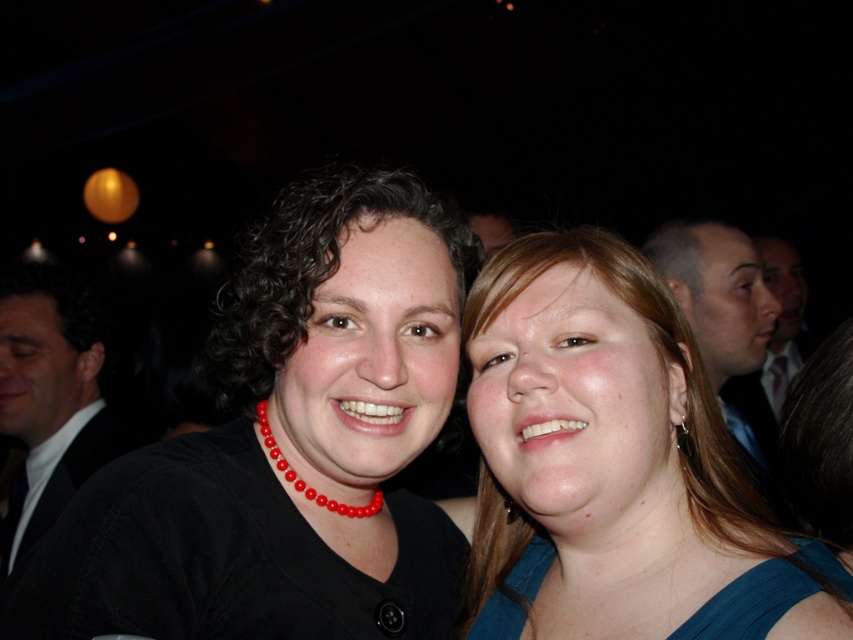
Is black suit at left to the right of shiny black suit at right from the viewer's perspective?

No, black suit at left is not to the right of shiny black suit at right.

Does black suit at left appear under shiny black suit at right?

Yes, black suit at left is below shiny black suit at right.

Between point (32, 502) and point (712, 378), which one is positioned in front?

Point (712, 378) is in front.

The image size is (853, 640). Identify the location of black suit at left. (53, 392).

Who is positioned more to the left, shiny black suit at right or red beaded necklace at center?

red beaded necklace at center is more to the left.

Between point (752, 253) and point (293, 470), which one is positioned behind?

The point (752, 253) is behind.

Identify the location of shiny black suit at right. (718, 305).

Does blue fabric at center appear on the right side of black suit at left?

Indeed, blue fabric at center is positioned on the right side of black suit at left.

Where is `blue fabric at center`? The height and width of the screenshot is (640, 853). blue fabric at center is located at coordinates (614, 465).